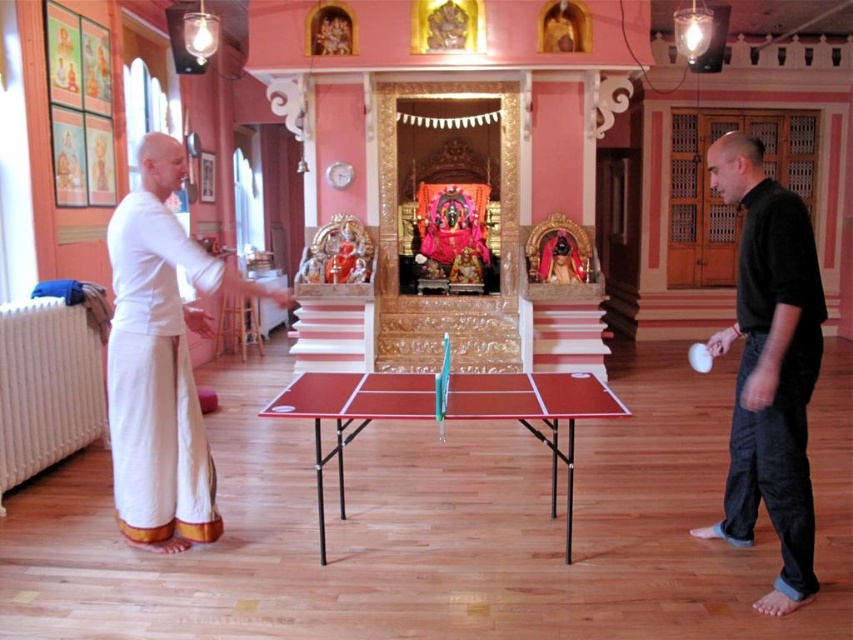
You are a photographer trying to capture a candid shot of the black cotton shirt at right and the red plastic table at center. Since you want to ensure both are in focus, you need to know which object is closer to the camera. Based on the scene description, which one is closer?

The black cotton shirt at right is thinner than the red plastic table at center, which suggests it is closer to the camera.

You are a table tennis player with a paddle in hand. You are standing where the black cotton shirt at right is positioned. The red plastic table at center has a ball rolling towards its edge. If you want to reach the ball before it falls off, can you make it in time? Assume your average speed is 3 feet per second and the ball is moving towards the edge at 1 foot per second.

The distance between the black cotton shirt at right and the red plastic table at center is 3.45 feet. To reach the ball before it falls off, you need to cover 3.45 feet at 3 feet per second, which would take about 1.15 seconds. The ball is moving at 1 foot per second, so in 1.15 seconds it would travel 1.15 feet. Since the table edge is more than 1.15 feet away from the ball, you can reach it in time.